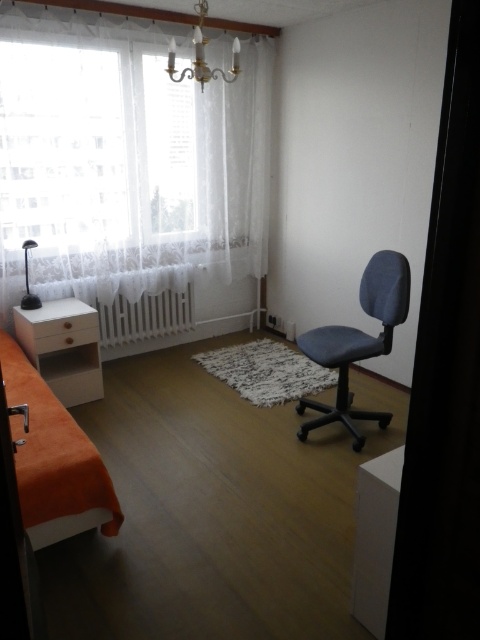
You are standing in the center of the room and want to reach the black plastic lamp at left without stepping on the white rug at center. Is the orange fabric bed at lower left blocking your path?

The orange fabric bed at lower left is below the black plastic lamp at left, so the bed is positioned lower and closer to the floor. Since you are standing in the center, you can step around the bed to reach the black plastic lamp at left without stepping on the white rug at center.

You are standing in the room and want to open the white lace curtain at upper left. Based on its position, which wall is it located on?

The white lace curtain at upper left is located on the left wall since it is positioned at point 0.250 on the x axis, which is the left side of the room.

You are standing in the center of the room and want to reach the window to open it. The window has a white lace curtain at upper left. There is a gold metallic chandelier at upper center in the way. Can you walk straight towards the window without moving the chandelier?

The white lace curtain at upper left is to the left of the gold metallic chandelier at upper center, so the chandelier is blocking the direct path to the window. You would need to move around the chandelier to reach the window.